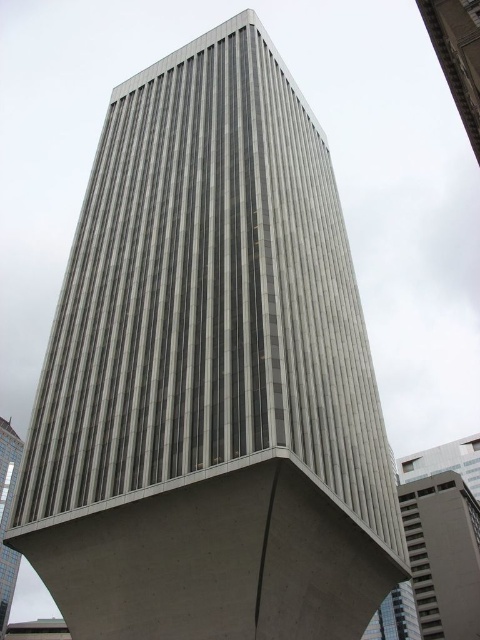
Question: Is gray concrete tower at upper right closer to camera compared to gray concrete tower at center?

Choices:
 (A) yes
 (B) no

Answer: (A)

Question: Is gray concrete tower at upper right thinner than gray concrete tower at center?

Choices:
 (A) yes
 (B) no

Answer: (A)

Question: Which of the following is the farthest from the observer?

Choices:
 (A) (9, 513)
 (B) (444, 592)

Answer: (B)

Question: Is gray concrete building at right wider than gray concrete tower at center?

Choices:
 (A) no
 (B) yes

Answer: (B)

Question: Which object appears closest to the camera in this image?

Choices:
 (A) gray concrete building at right
 (B) gray concrete tower at center

Answer: (A)

Question: Which is farther from the gray concrete tower at center?

Choices:
 (A) gray concrete building at right
 (B) gray concrete tower at upper right

Answer: (B)